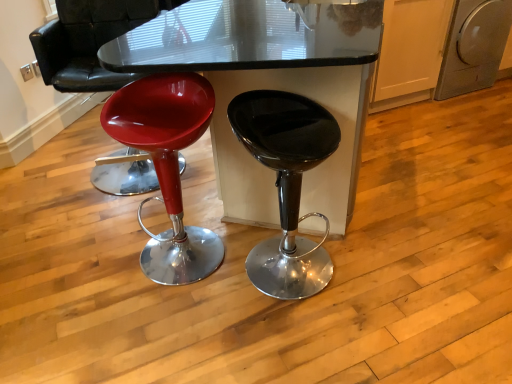
Locate an element on the screen. free space in front of glossy glass table at center is located at coordinates (298, 317).